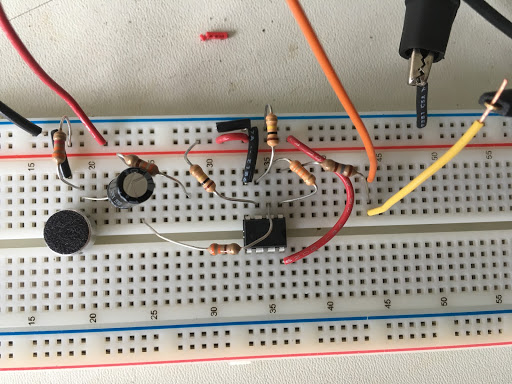
Locate an element on the screen. This screenshot has width=512, height=384. exposed wire is located at coordinates 497,94.